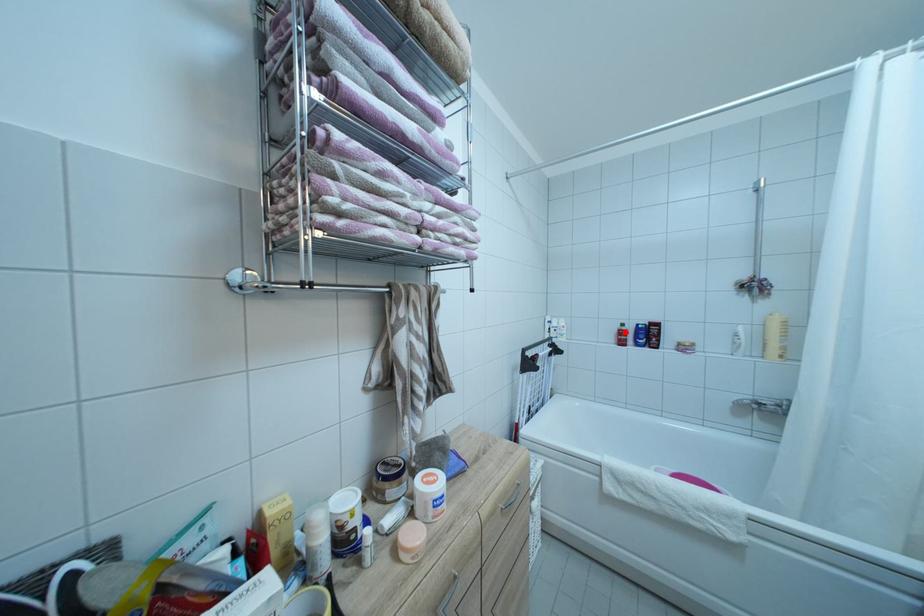
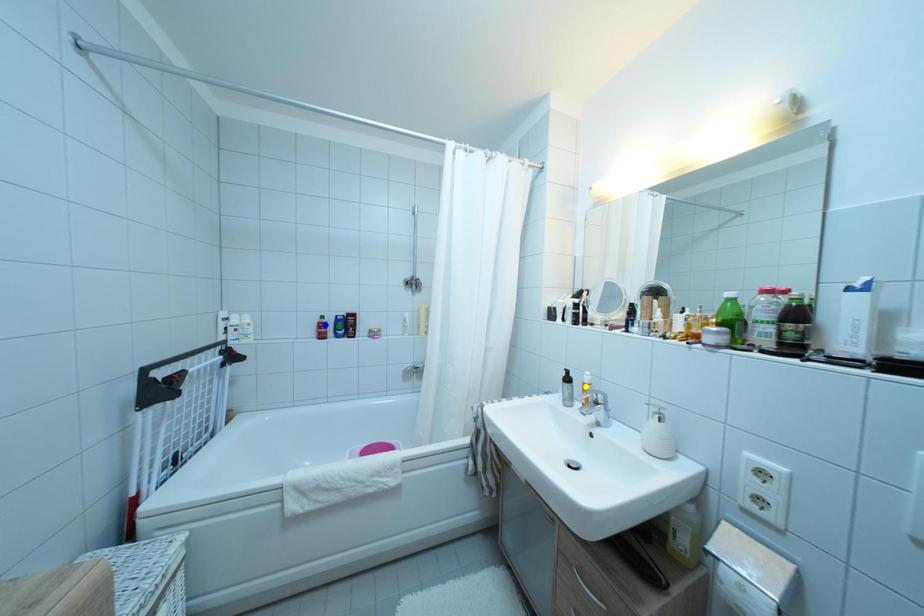
Question: I am providing you with two images of the same scene from different viewpoints. A red point is marked on the first image. You are given multiple points on the second image. Which mark in image 2 goes with the point in image 1?

Choices:
 (A) blue point
 (B) green point
 (C) yellow point

Answer: (A)